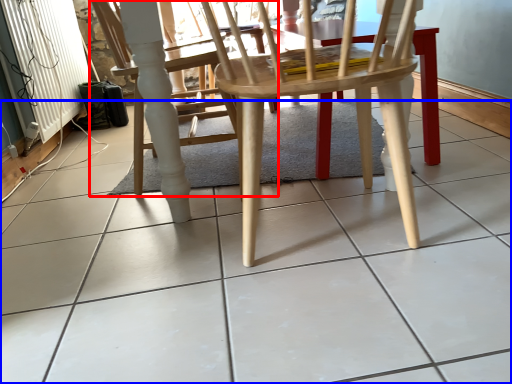
Question: Which point is closer to the camera, chair (highlighted by a red box) or ceramic tile (highlighted by a blue box)?

Choices:
 (A) chair
 (B) ceramic tile

Answer: (B)